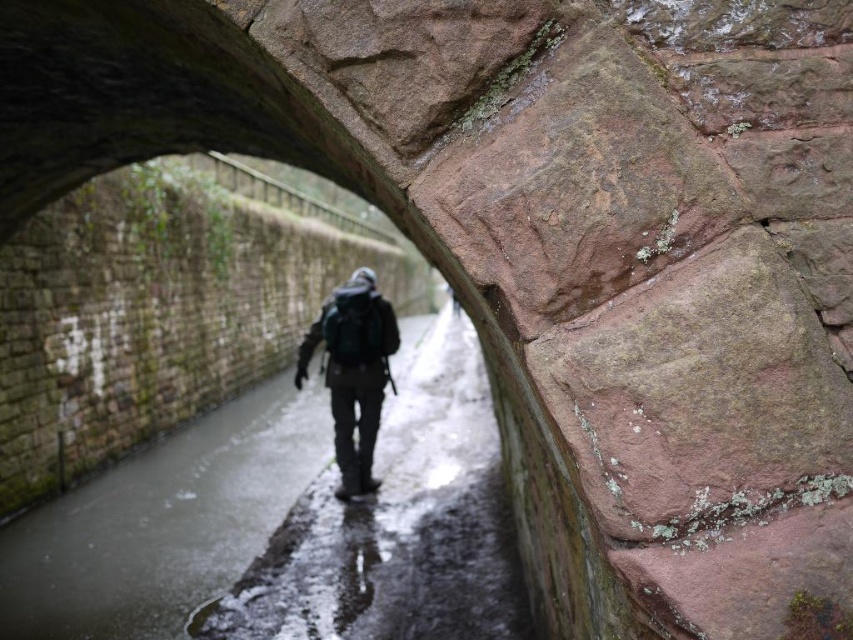
You are standing at the entrance of the stone archway and see a point marked at coordinates point (397, 525). What is located at that point?

The point (397, 525) is where the wet concrete path at center is located.

You are standing at the entrance of the stone archway and want to walk towards the person in the image. Which direction should you move relative to the wet concrete path at center?

The wet concrete path at center is located at coordinates point (397,525), so you should move towards the wet concrete path at center to reach the person since they are moving away from you in that direction.

You are standing under the stone archway and want to place a small potted plant on the path. Can you put it on the wet concrete path at center without it being in front of the dark green backpack at center?

The wet concrete path at center is closer to the viewer than the dark green backpack at center, so placing the potted plant on the wet concrete path at center would not block the view of the dark green backpack at center since the path is in front of the backpack.